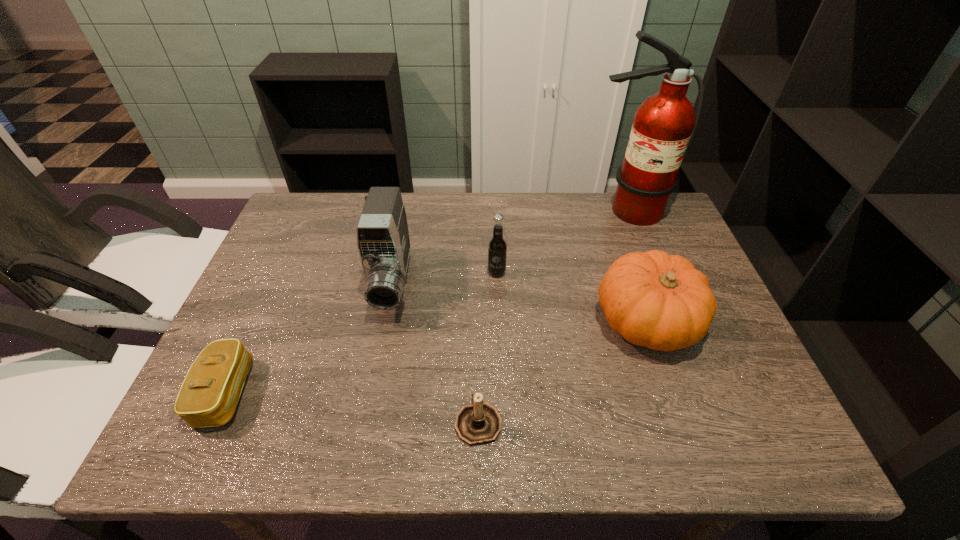
Identify the location of the tallest object. (664, 124).

At what (x,y) coordinates should I click in order to perform the action: click on fire extinguisher. Please return your answer as a coordinate pair (x, y). The height and width of the screenshot is (540, 960). Looking at the image, I should click on (664, 124).

At what (x,y) coordinates should I click in order to perform the action: click on the second tallest object. Please return your answer as a coordinate pair (x, y). Looking at the image, I should click on (383, 242).

In order to click on the fifth object from right to left in this screenshot , I will do `click(383, 242)`.

This screenshot has height=540, width=960. In order to click on root beer in this screenshot , I will do `click(497, 248)`.

Where is `pumpkin`? pumpkin is located at coordinates (660, 301).

Find the location of a particular element. The width and height of the screenshot is (960, 540). the fifth tallest object is located at coordinates (479, 423).

At what (x,y) coordinates should I click in order to perform the action: click on the leftmost object. Please return your answer as a coordinate pair (x, y). Looking at the image, I should click on (208, 397).

The width and height of the screenshot is (960, 540). Identify the location of the shortest object. (208, 397).

Find the location of a particular element. Image resolution: width=960 pixels, height=540 pixels. free space located 0.210m on the nozzle and handle of the fire extinguisher is located at coordinates (652, 278).